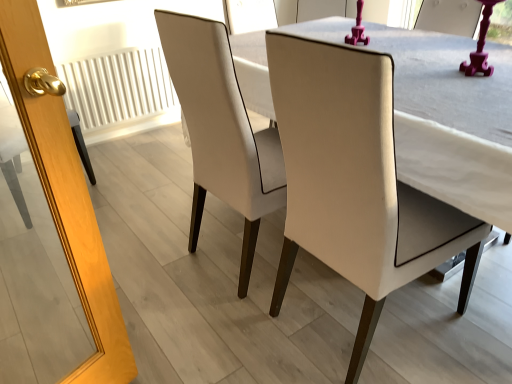
Where is `vacant space in white textured radiator at left (from a real-world perspective)`? Image resolution: width=512 pixels, height=384 pixels. vacant space in white textured radiator at left (from a real-world perspective) is located at coordinates (132, 132).